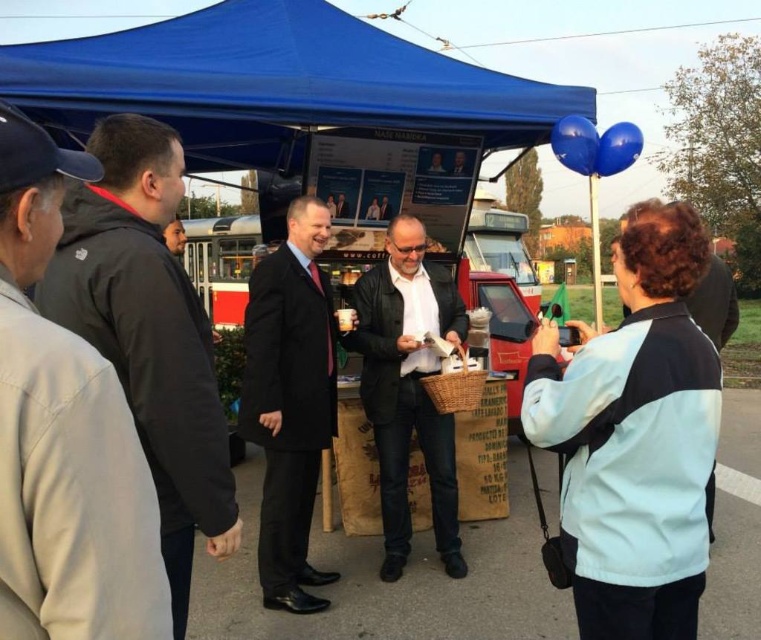
Can you confirm if matte black jacket at center is positioned below wooden basket at center?

Yes, matte black jacket at center is below wooden basket at center.

Is point (412, 282) positioned before point (221, 298)?

Yes, point (412, 282) is closer to viewer.

Where is `matte black jacket at center`? Image resolution: width=761 pixels, height=640 pixels. matte black jacket at center is located at coordinates [408, 387].

Is dark gray jacket at left below black matte suit at center?

Actually, dark gray jacket at left is above black matte suit at center.

Is dark gray jacket at left smaller than black matte suit at center?

No, dark gray jacket at left is not smaller than black matte suit at center.

The image size is (761, 640). Identify the location of dark gray jacket at left. (148, 333).

Does blue fabric canopy at upper center appear on the right side of black matte suit at center?

Indeed, blue fabric canopy at upper center is positioned on the right side of black matte suit at center.

Between point (314, 97) and point (311, 364), which one is positioned in front?

Positioned in front is point (311, 364).

This screenshot has height=640, width=761. What do you see at coordinates (272, 83) in the screenshot?
I see `blue fabric canopy at upper center` at bounding box center [272, 83].

The image size is (761, 640). What are the coordinates of `blue fabric canopy at upper center` in the screenshot? It's located at (272, 83).